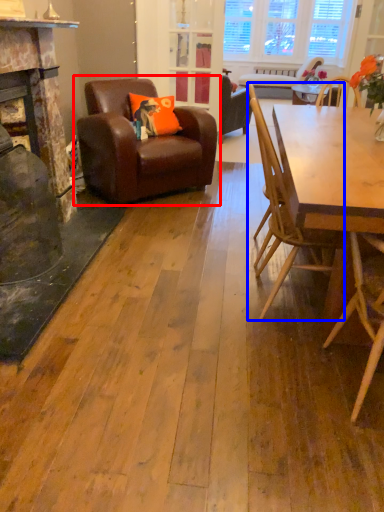
Question: Which of the following is the closest to the observer, chair (highlighted by a red box) or chair (highlighted by a blue box)?

Choices:
 (A) chair
 (B) chair

Answer: (B)